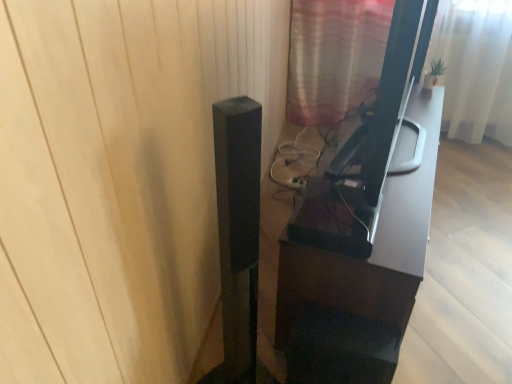
Describe the element at coordinates (362, 275) in the screenshot. I see `black glossy tv stand at center` at that location.

At what (x,y) coordinates should I click in order to perform the action: click on black glossy tv stand at center. Please return your answer as a coordinate pair (x, y). The width and height of the screenshot is (512, 384). Looking at the image, I should click on (362, 275).

Measure the distance between point (290, 375) and camera.

The distance of point (290, 375) from camera is 4.91 feet.

Identify the location of black glossy tv stand at center. (362, 275).